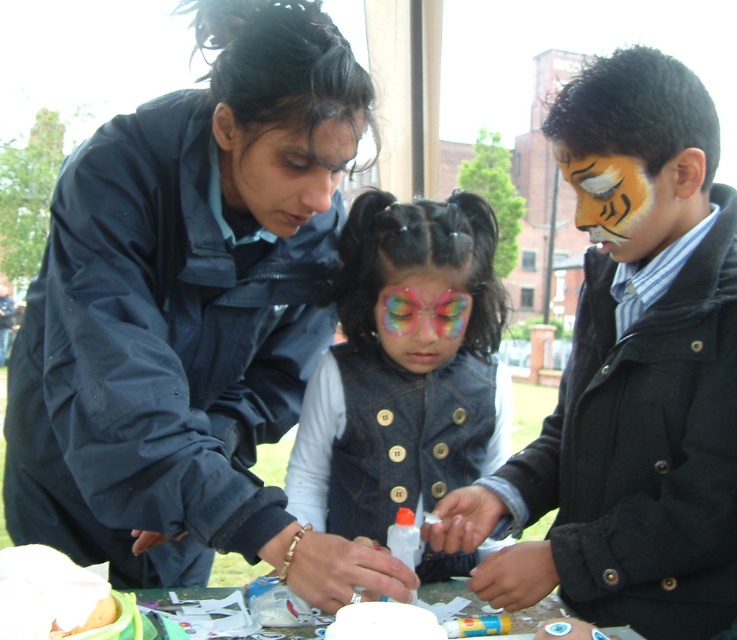
Is point (399, 228) positioned before point (338, 120)?

No, (399, 228) is behind (338, 120).

Between point (324, 465) and point (287, 236), which one is positioned behind?

Point (324, 465)

The image size is (737, 640). I want to click on denim vest at center, so click(405, 368).

Does matte black hair at center have a lesser width compared to glittery rainbow face paint at center?

Incorrect, matte black hair at center's width is not less than glittery rainbow face paint at center's.

Measure the distance between matte black hair at center and glittery rainbow face paint at center.

matte black hair at center is 10.61 inches from glittery rainbow face paint at center.

Image resolution: width=737 pixels, height=640 pixels. What are the coordinates of `matte black hair at center` in the screenshot? It's located at (282, 166).

The height and width of the screenshot is (640, 737). Identify the location of matte blue jacket at center. [x=192, y=316].

Who is more forward, (69, 291) or (388, 285)?

Point (69, 291)

Does point (296, 196) come closer to viewer compared to point (425, 362)?

Yes, point (296, 196) is closer to viewer.

This screenshot has height=640, width=737. I want to click on matte blue jacket at center, so click(x=192, y=316).